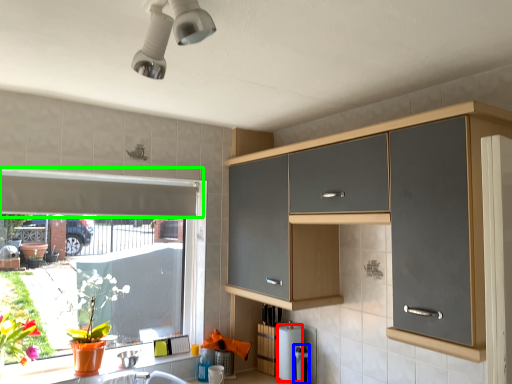
Question: Which object is the farthest from toilet paper (highlighted by a red box)? Choose among these: appliance (highlighted by a blue box) or exhaust hood (highlighted by a green box).

Choices:
 (A) appliance
 (B) exhaust hood

Answer: (B)